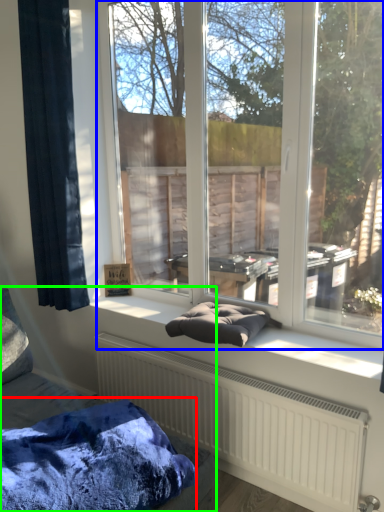
Question: Considering the real-world distances, which object is farthest from blanket (highlighted by a red box)? window (highlighted by a blue box) or furniture (highlighted by a green box)?

Choices:
 (A) window
 (B) furniture

Answer: (A)